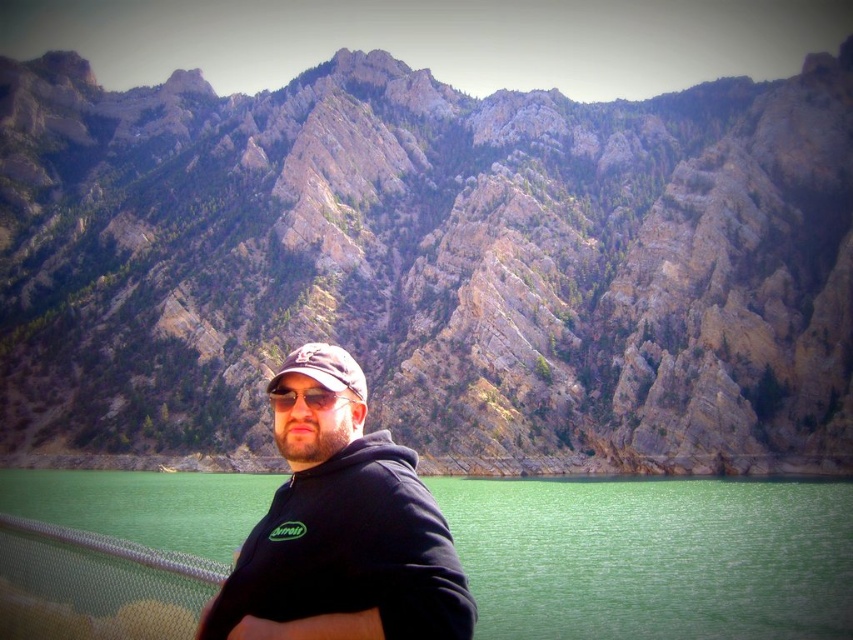
You are a photographer trying to capture the scenic mountain backdrop. You notice the black matte hoodie at center and the matte black sunglasses at center. Which object is positioned higher on the person wearing them?

The black matte hoodie at center is located above the matte black sunglasses at center, so the hoodie is positioned higher.

You are a hiker trying to locate the highest peak in the area. According to the map, there is a point marked at coordinates (428, 266). What does this point indicate?

The point at coordinates (428, 266) indicates the location of the rocky gray mountain at center, which is the highest peak in the area.

You are a photographer trying to capture the scenic mountain backdrop. You notice the black matte hoodie at center and the matte black sunglasses at center. Which object is wider when viewed from your position?

The black matte hoodie at center is wider than the matte black sunglasses at center.